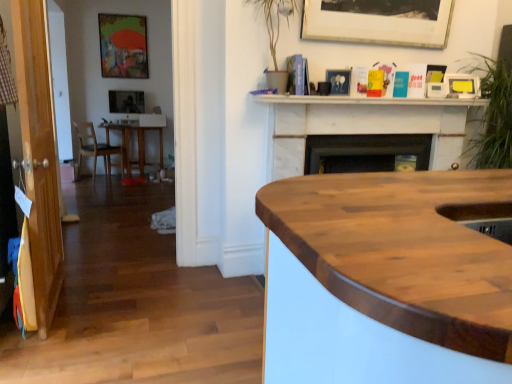
Question: Is matte wooden picture frame at upper left, the 2th picture frame in the back-to-front sequence, positioned with its back to transparent wood door at left?

Choices:
 (A) no
 (B) yes

Answer: (A)

Question: Can you confirm if matte wooden picture frame at upper left, positioned as the third picture frame in front-to-back order, is thinner than transparent wood door at left?

Choices:
 (A) yes
 (B) no

Answer: (A)

Question: Does matte wooden picture frame at upper left, positioned as the third picture frame in front-to-back order, have a greater width compared to transparent wood door at left?

Choices:
 (A) no
 (B) yes

Answer: (A)

Question: Is matte wooden picture frame at upper left, placed as the fourth picture frame when sorted from right to left, not close to transparent wood door at left?

Choices:
 (A) no
 (B) yes

Answer: (B)

Question: Is matte wooden picture frame at upper left, the fourth picture frame ordered from the bottom, in contact with transparent wood door at left?

Choices:
 (A) no
 (B) yes

Answer: (A)

Question: Considering their positions, is yellow matte picture frame at upper right, which appears as the 2th picture frame when ordered from the bottom, located in front of or behind wooden table at left?

Choices:
 (A) front
 (B) behind

Answer: (A)

Question: Is yellow matte picture frame at upper right, the second picture frame in the front-to-back sequence, to the left or to the right of wooden table at left in the image?

Choices:
 (A) right
 (B) left

Answer: (A)

Question: Does point (471, 79) appear closer or farther from the camera than point (157, 163)?

Choices:
 (A) farther
 (B) closer

Answer: (B)

Question: In terms of width, does yellow matte picture frame at upper right, which is the third picture frame from back to front, look wider or thinner when compared to wooden table at left?

Choices:
 (A) thin
 (B) wide

Answer: (A)

Question: In the image, is yellow matte picture frame at upper right, the 3th picture frame when ordered from top to bottom, on the left side or the right side of matte black picture frame at upper left, marked as the second picture frame in a left-to-right arrangement?

Choices:
 (A) left
 (B) right

Answer: (B)

Question: From their relative heights in the image, would you say yellow matte picture frame at upper right, the 1th picture frame from the right, is taller or shorter than matte black picture frame at upper left, which is the fourth picture frame in front-to-back order?

Choices:
 (A) tall
 (B) short

Answer: (B)

Question: In terms of width, does yellow matte picture frame at upper right, which is the third picture frame from back to front, look wider or thinner when compared to matte black picture frame at upper left, which is the fourth picture frame in front-to-back order?

Choices:
 (A) thin
 (B) wide

Answer: (B)

Question: Is yellow matte picture frame at upper right, the 1th picture frame from the right, inside or outside of matte black picture frame at upper left, marked as the second picture frame in a left-to-right arrangement?

Choices:
 (A) inside
 (B) outside

Answer: (B)

Question: Does point (138, 132) appear closer or farther from the camera than point (475, 86)?

Choices:
 (A) farther
 (B) closer

Answer: (A)

Question: In terms of size, does wooden table at left appear bigger or smaller than yellow matte picture frame at upper right, which is the fourth picture frame from left to right?

Choices:
 (A) big
 (B) small

Answer: (A)